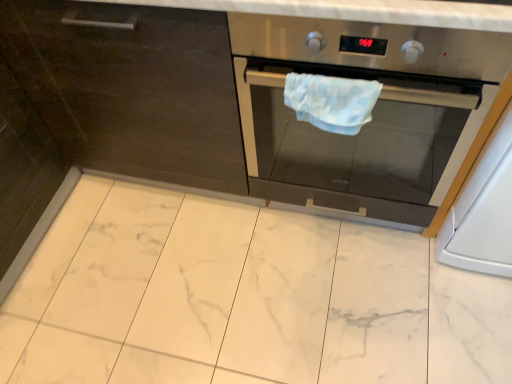
Measure the distance between stainless steel oven at center and camera.

stainless steel oven at center is 31.18 inches away from camera.

Find the location of a particular element. light blue fabric hand towel at center is located at coordinates (332, 101).

Is light blue fabric hand towel at center with white glossy oven at right?

No.

Is light blue fabric hand towel at center at the right side of white glossy oven at right?

Incorrect, light blue fabric hand towel at center is not on the right side of white glossy oven at right.

Is light blue fabric hand towel at center wider or thinner than white glossy oven at right?

In the image, light blue fabric hand towel at center appears to be more narrow than white glossy oven at right.

Can you confirm if stainless steel oven at center is taller than white glossy oven at right?

In fact, stainless steel oven at center may be shorter than white glossy oven at right.

Does stainless steel oven at center appear on the left side of white glossy oven at right?

Yes.

Does point (390, 134) come farther from viewer compared to point (485, 234)?

No.

I want to click on home appliance above the white glossy oven at right (from the image's perspective), so click(373, 112).

This screenshot has height=384, width=512. What are the coordinates of `hand towel located above the stainless steel oven at center (from the image's perspective)` in the screenshot? It's located at (332, 101).

Is light blue fabric hand towel at center facing towards stainless steel oven at center?

Yes, light blue fabric hand towel at center is turned towards stainless steel oven at center.

Which object is positioned more to the left, light blue fabric hand towel at center or stainless steel oven at center?

light blue fabric hand towel at center is more to the left.

Looking at this image, from a real-world perspective, between white glossy oven at right and stainless steel oven at center, who is vertically higher?

stainless steel oven at center, from a real-world perspective.

Does white glossy oven at right appear on the left side of stainless steel oven at center?

No.

Considering the positions of point (495, 208) and point (420, 165), is point (495, 208) closer or farther from the camera than point (420, 165)?

Point (495, 208) appears to be closer to the viewer than point (420, 165).

Consider the image. Which object is more forward, white glossy oven at right or stainless steel oven at center?

stainless steel oven at center.

Is stainless steel oven at center not inside light blue fabric hand towel at center?

Absolutely, stainless steel oven at center is external to light blue fabric hand towel at center.

The width and height of the screenshot is (512, 384). I want to click on hand towel to the left of stainless steel oven at center, so click(x=332, y=101).

Relative to light blue fabric hand towel at center, is stainless steel oven at center in front or behind?

Visually, stainless steel oven at center is located in front of light blue fabric hand towel at center.

Can you confirm if stainless steel oven at center is taller than light blue fabric hand towel at center?

Yes.

In the scene shown: Is white glossy oven at right placed right next to light blue fabric hand towel at center?

white glossy oven at right is not next to light blue fabric hand towel at center, and they're not touching.

Which of these two, white glossy oven at right or light blue fabric hand towel at center, stands shorter?

light blue fabric hand towel at center is shorter.

Considering the relative positions of white glossy oven at right and light blue fabric hand towel at center in the image provided, is white glossy oven at right to the left of light blue fabric hand towel at center from the viewer's perspective?

No, white glossy oven at right is not to the left of light blue fabric hand towel at center.

Is white glossy oven at right positioned in front of light blue fabric hand towel at center?

Yes, white glossy oven at right is closer to the viewer.

In the image, there is a white glossy oven at right. Where is `hand towel above it (from the image's perspective)`? This screenshot has height=384, width=512. hand towel above it (from the image's perspective) is located at coordinates (332, 101).

At what (x,y) coordinates should I click in order to perform the action: click on appliance lying below the stainless steel oven at center (from the image's perspective). Please return your answer as a coordinate pair (x, y). The height and width of the screenshot is (384, 512). Looking at the image, I should click on (483, 214).

Considering their positions, is stainless steel oven at center positioned closer to light blue fabric hand towel at center than white glossy oven at right?

stainless steel oven at center is closer to light blue fabric hand towel at center.

Consider the image. From the image, which object appears to be nearer to stainless steel oven at center, white glossy oven at right or light blue fabric hand towel at center?

light blue fabric hand towel at center is closer to stainless steel oven at center.

Based on their spatial positions, is stainless steel oven at center or light blue fabric hand towel at center closer to white glossy oven at right?

Among the two, stainless steel oven at center is located nearer to white glossy oven at right.

Based on their spatial positions, is light blue fabric hand towel at center or white glossy oven at right closer to stainless steel oven at center?

Based on the image, light blue fabric hand towel at center appears to be nearer to stainless steel oven at center.

Which object lies nearer to the anchor point light blue fabric hand towel at center, white glossy oven at right or stainless steel oven at center?

Based on the image, stainless steel oven at center appears to be nearer to light blue fabric hand towel at center.

Based on their spatial positions, is light blue fabric hand towel at center or stainless steel oven at center closer to white glossy oven at right?

stainless steel oven at center.

Locate an element on the screen. This screenshot has width=512, height=384. home appliance between light blue fabric hand towel at center and white glossy oven at right is located at coordinates (373, 112).